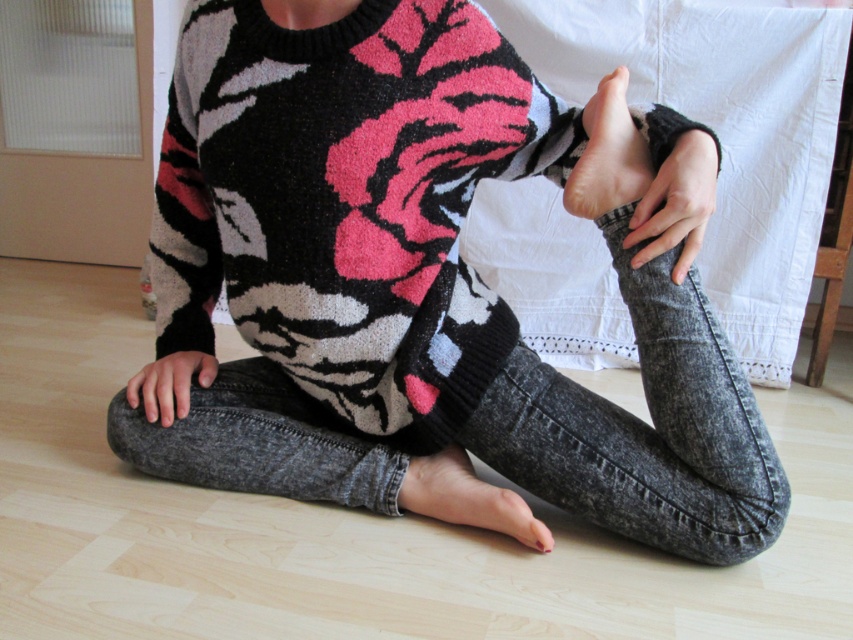
You are designing a new fashion line and want to place a small decorative sticker on either the knit sweater at center or the pink matte foot at center. Which object would allow the sticker to be more visible due to its size?

The knit sweater at center has a larger size compared to the pink matte foot at center, so placing the sticker on the knit sweater at center would make it more visible due to its larger surface area.

Consider the image. You are a physical therapist evaluating a patient who is performing a stretching exercise. The patient has their smooth skin hand at center and smooth skin foot at lower center in the position shown. Which body part is narrower in this pose?

The smooth skin hand at center is thinner than the smooth skin foot at lower center, so the hand is narrower.

You are standing in the room and want to place a small sticker on the point that is closer to you. Which point should you choose between point (672, 262) and point (463, 460)?

Point (672, 262) is closer to the viewer than point (463, 460), so you should choose point (672, 262) to place the sticker.